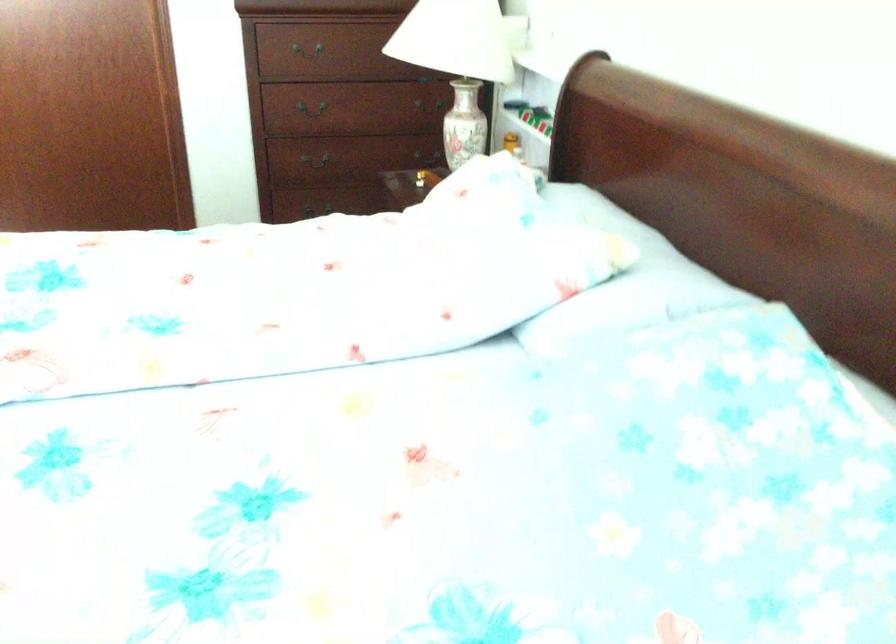
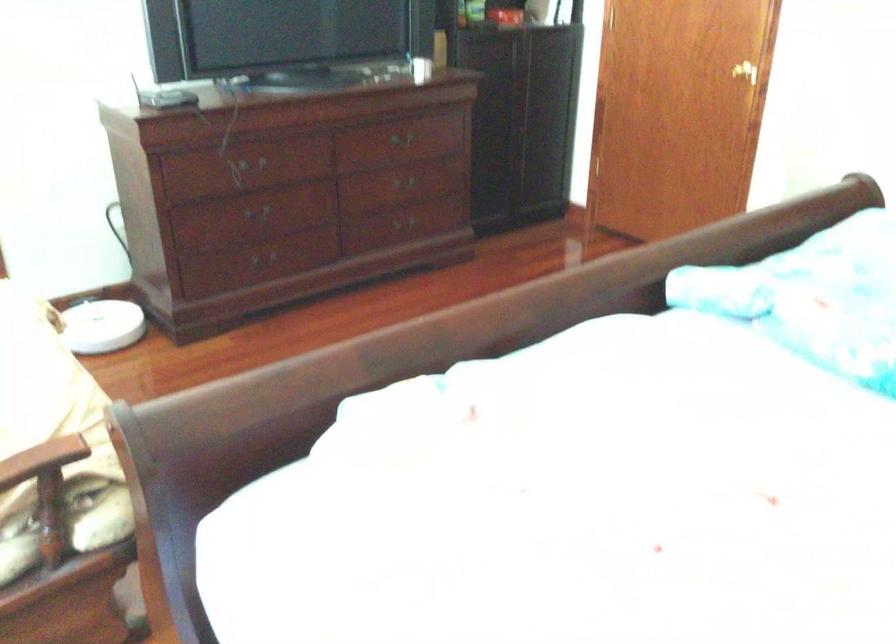
Question: The camera is either moving clockwise (left) or counter-clockwise (right) around the object. The first image is from the beginning of the video and the second image is from the end. Is the camera moving left or right when shooting the video?

Choices:
 (A) Left
 (B) Right

Answer: (B)